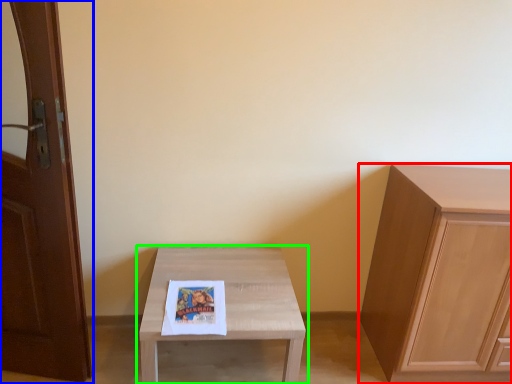
Question: Which is nearer to the cabinetry (highlighted by a red box)? door (highlighted by a blue box) or table (highlighted by a green box).

Choices:
 (A) door
 (B) table

Answer: (B)